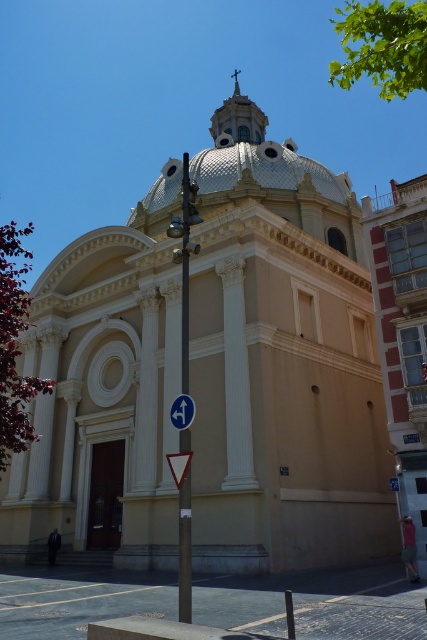
You are a pedestrian standing on the street in front of the cathedral. You see the metallic pole at center and the white plastic triangle at center. Which object is higher from the ground?

The metallic pole at center is above the white plastic triangle at center, so the metallic pole at center is higher from the ground.

You are standing at the entrance of the classical architectural structure described in the scene. You notice a metallic pole located at point (x=186, y=266). In which direction relative to the dome should you walk to reach the metallic pole?

The metallic pole at center is located at point (x=186, y=266), which is directly in front of the dome, so you should walk straight ahead towards the center to reach it.